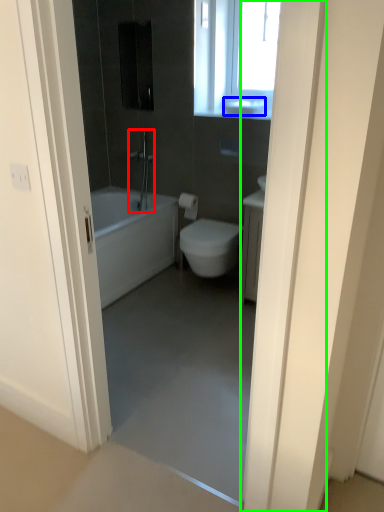
Question: Estimate the real-world distances between objects in this image. Which object is farther from shower (highlighted by a red box), sink (highlighted by a blue box) or door (highlighted by a green box)?

Choices:
 (A) sink
 (B) door

Answer: (B)